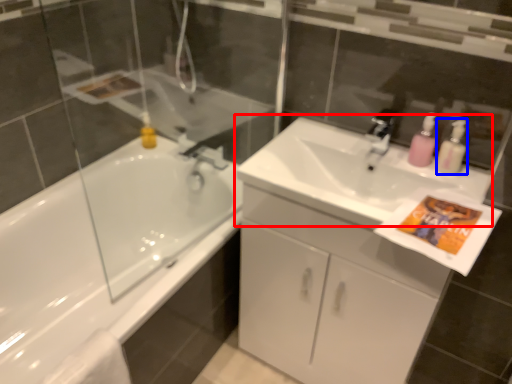
Question: Which point is closer to the camera, sink (highlighted by a red box) or cleaning product (highlighted by a blue box)?

Choices:
 (A) sink
 (B) cleaning product

Answer: (A)